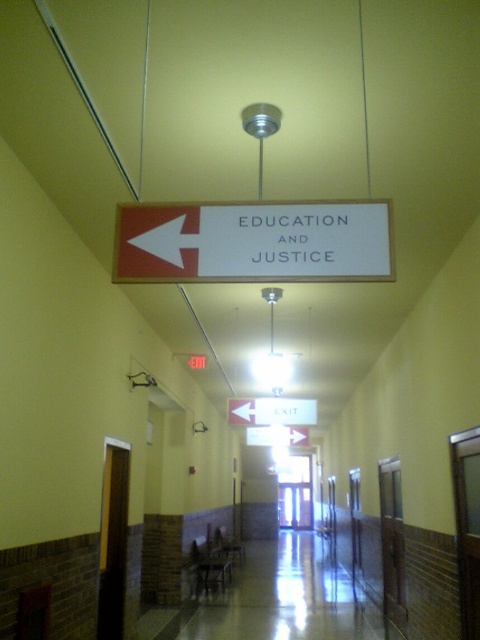
You are a maintenance worker needing to replace the white matte sign at center and the white matte arrow at upper left. If you have a ladder that can reach up to 2.5 meters, will you be able to reach both objects from the ground?

The question cannot be answered with the provided information because the height of the white matte sign at center and white matte arrow at upper left is not specified in the Objects Description.

You are standing in the hallway and want to find the direction indicated by the white matte sign at center. According to the sign, which direction should you turn?

The white matte sign at center has an arrow pointing left, so you should turn left to follow the direction indicated by the sign.

You are standing in the hallway and want to follow the arrow pointing towards the sign. Based on the white matte sign at center and the white matte arrow at upper left, which direction should you turn to follow the arrow towards the sign?

The white matte sign at center is positioned on the right side of the white matte arrow at upper left, so to follow the arrow towards the sign, you should turn right.